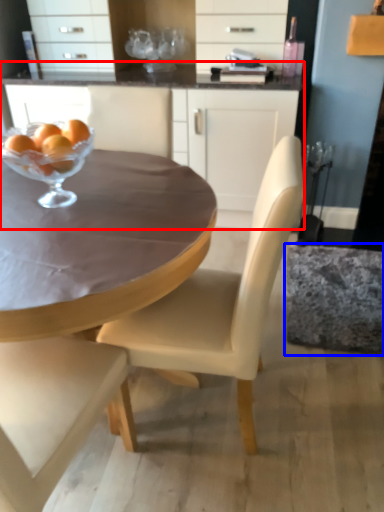
Question: Which object is further to the camera taking this photo, cabinetry (highlighted by a red box) or swivel chair (highlighted by a blue box)?

Choices:
 (A) cabinetry
 (B) swivel chair

Answer: (A)